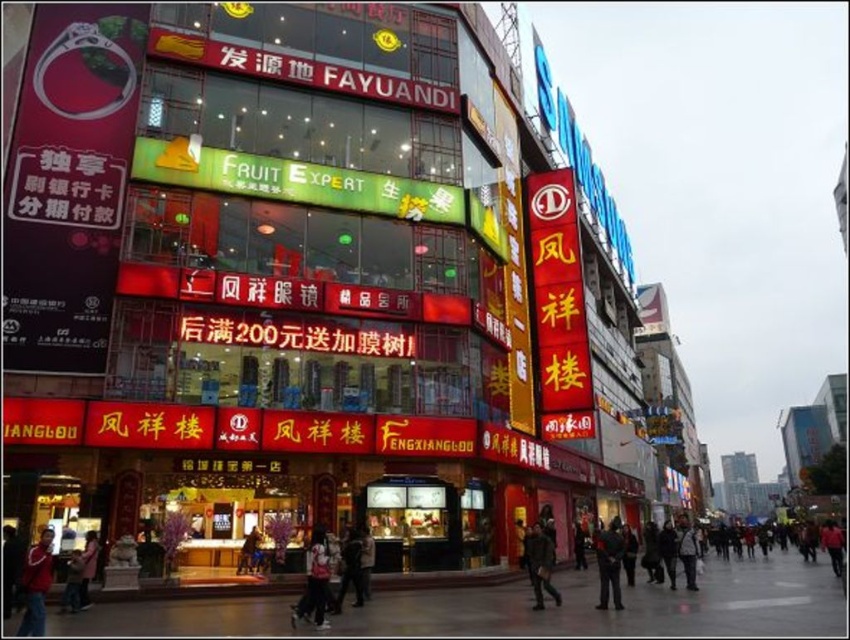
Can you confirm if red sweater at lower left is bigger than dark gray jacket at lower right?

Incorrect, red sweater at lower left is not larger than dark gray jacket at lower right.

In the scene shown: Who is more forward, [26,595] or [547,586]?

Point [26,595] is in front.

Where is `red sweater at lower left`? This screenshot has width=850, height=640. red sweater at lower left is located at coordinates (37, 586).

Is red sweater at lower left thinner than dark gray jacket at lower center?

Indeed, red sweater at lower left has a lesser width compared to dark gray jacket at lower center.

This screenshot has height=640, width=850. What are the coordinates of `red sweater at lower left` in the screenshot? It's located at (37, 586).

Is point (40, 616) closer to camera compared to point (608, 593)?

That is True.

Locate an element on the screen. The image size is (850, 640). red sweater at lower left is located at coordinates (37, 586).

Does dark gray jacket at lower center have a greater width compared to dark gray jacket at lower right?

Indeed, dark gray jacket at lower center has a greater width compared to dark gray jacket at lower right.

In the scene shown: Does dark gray jacket at lower center appear on the right side of dark gray jacket at lower right?

Indeed, dark gray jacket at lower center is positioned on the right side of dark gray jacket at lower right.

The width and height of the screenshot is (850, 640). What do you see at coordinates (609, 563) in the screenshot?
I see `dark gray jacket at lower center` at bounding box center [609, 563].

The width and height of the screenshot is (850, 640). Find the location of `dark gray jacket at lower center`. dark gray jacket at lower center is located at coordinates (609, 563).